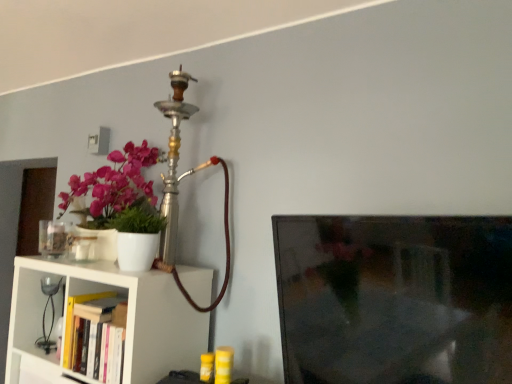
Question: Considering the relative sizes of white matte shelf at lower left and hardcover book at lower left in the image provided, is white matte shelf at lower left thinner than hardcover book at lower left?

Choices:
 (A) no
 (B) yes

Answer: (A)

Question: Considering the relative sizes of white matte shelf at lower left and hardcover book at lower left in the image provided, is white matte shelf at lower left taller than hardcover book at lower left?

Choices:
 (A) no
 (B) yes

Answer: (B)

Question: Is white matte shelf at lower left to the left of hardcover book at lower left from the viewer's perspective?

Choices:
 (A) yes
 (B) no

Answer: (B)

Question: Considering the relative sizes of white matte shelf at lower left and hardcover book at lower left in the image provided, is white matte shelf at lower left wider than hardcover book at lower left?

Choices:
 (A) yes
 (B) no

Answer: (A)

Question: Could you tell me if white matte shelf at lower left is facing hardcover book at lower left?

Choices:
 (A) yes
 (B) no

Answer: (A)

Question: Is black glass table lamp at left taller or shorter than white matte shelf at lower left?

Choices:
 (A) tall
 (B) short

Answer: (B)

Question: Is black glass table lamp at left in front of or behind white matte shelf at lower left in the image?

Choices:
 (A) front
 (B) behind

Answer: (B)

Question: From the image's perspective, is black glass table lamp at left above or below white matte shelf at lower left?

Choices:
 (A) above
 (B) below

Answer: (A)

Question: In terms of width, does black glass table lamp at left look wider or thinner when compared to white matte shelf at lower left?

Choices:
 (A) wide
 (B) thin

Answer: (B)

Question: Relative to black glass table lamp at left, is hardcover book at lower left in front or behind?

Choices:
 (A) front
 (B) behind

Answer: (A)

Question: From a real-world perspective, is hardcover book at lower left physically located above or below black glass table lamp at left?

Choices:
 (A) below
 (B) above

Answer: (A)

Question: Based on their positions, is hardcover book at lower left located to the left or right of black glass table lamp at left?

Choices:
 (A) right
 (B) left

Answer: (A)

Question: Considering the positions of hardcover book at lower left and black glass table lamp at left in the image, is hardcover book at lower left wider or thinner than black glass table lamp at left?

Choices:
 (A) thin
 (B) wide

Answer: (B)

Question: Is black glass table lamp at left taller or shorter than hardcover book at lower left?

Choices:
 (A) short
 (B) tall

Answer: (B)

Question: From the image's perspective, is black glass table lamp at left located above or below hardcover book at lower left?

Choices:
 (A) below
 (B) above

Answer: (B)